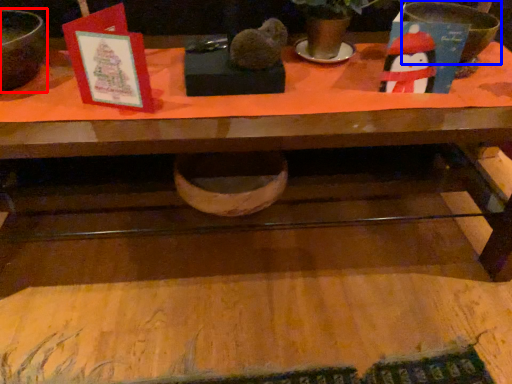
Question: Which point is closer to the camera, mixing bowl (highlighted by a red box) or basin (highlighted by a blue box)?

Choices:
 (A) mixing bowl
 (B) basin

Answer: (A)